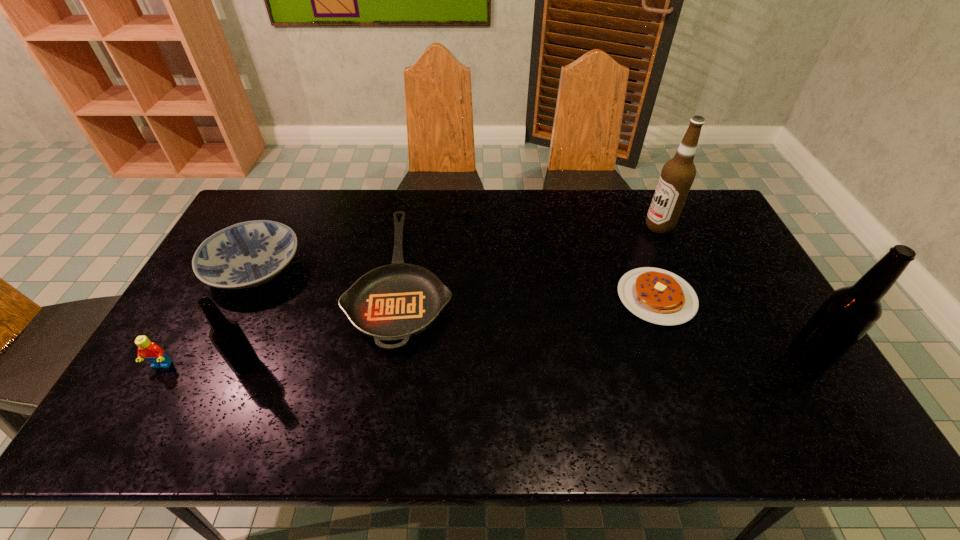
Locate an element on the screen. The width and height of the screenshot is (960, 540). free region located 0.140m on the back of the right beer bottle is located at coordinates click(774, 302).

You are a GUI agent. You are given a task and a screenshot of the screen. Output one action in this format:
    pyautogui.click(x=<x>, y=<y>)
    Task: Click on the free region located on the right of the fourth object from right to left
    The image size is (960, 540).
    Given the screenshot: What is the action you would take?
    pyautogui.click(x=507, y=280)

Locate an element on the screen. Image resolution: width=960 pixels, height=540 pixels. vacant position located 0.060m on the label of the alcohol is located at coordinates click(627, 226).

Locate an element on the screen. Image resolution: width=960 pixels, height=540 pixels. free region located on the label of the alcohol is located at coordinates (530, 226).

Find the location of a particular element. free space located 0.150m on the label of the alcohol is located at coordinates (601, 226).

The image size is (960, 540). Identify the location of free spot located on the left of the pancake. (500, 298).

I want to click on free region located on the right of the plate, so pyautogui.click(x=429, y=268).

In order to click on frying pan present at the far edge in this screenshot , I will do `click(394, 302)`.

I want to click on alcohol located in the far edge section of the desktop, so click(677, 176).

I want to click on Lego that is at the near edge, so click(148, 350).